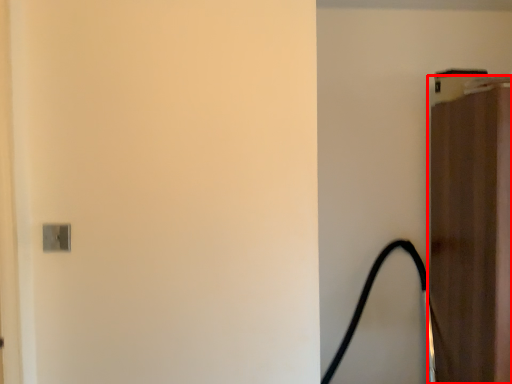
Question: From the image's perspective, what is the correct spatial positioning of door (annotated by the red box) in reference to garden hose?

Choices:
 (A) below
 (B) above

Answer: (B)